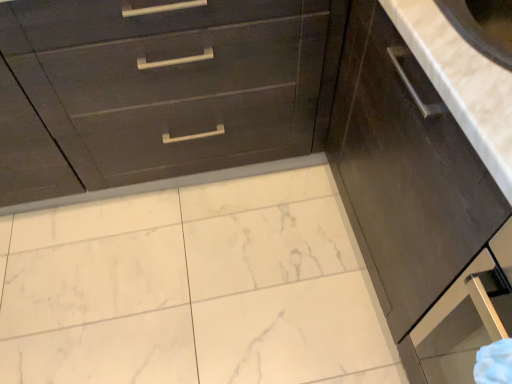
Question: Is white marble countertop at upper right in front of or behind dark wood drawer at upper left in the image?

Choices:
 (A) front
 (B) behind

Answer: (A)

Question: From a real-world perspective, is white marble countertop at upper right positioned above or below dark wood drawer at upper left?

Choices:
 (A) below
 (B) above

Answer: (B)

Question: Considering the real-world distances, which object is farthest from the dark wood drawer at upper left?

Choices:
 (A) dark wood cabinet at right
 (B) white marble countertop at upper right

Answer: (B)

Question: Based on their relative distances, which object is farther from the white marble countertop at upper right?

Choices:
 (A) dark wood drawer at upper left
 (B) dark wood cabinet at right

Answer: (A)